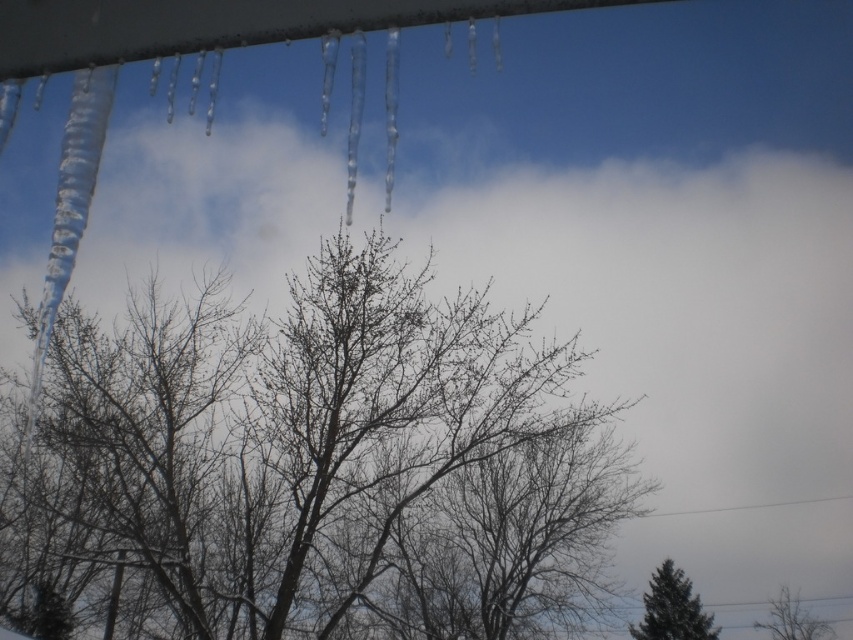
Question: Among these objects, which one is nearest to the camera?

Choices:
 (A) bare branches at lower right
 (B) green matte tree at lower right

Answer: (B)

Question: Among these objects, which one is farthest from the camera?

Choices:
 (A) green matte tree at lower right
 (B) bare branches at center
 (C) bare branches at lower right

Answer: (C)

Question: Which object appears farthest from the camera in this image?

Choices:
 (A) bare branches at lower right
 (B) green matte tree at lower right

Answer: (A)

Question: Does bare branches at center have a smaller size compared to green matte tree at lower right?

Choices:
 (A) no
 (B) yes

Answer: (A)

Question: Where is bare branches at center located in relation to green matte tree at lower right in the image?

Choices:
 (A) right
 (B) left

Answer: (B)

Question: Is bare branches at center below bare branches at lower right?

Choices:
 (A) yes
 (B) no

Answer: (B)